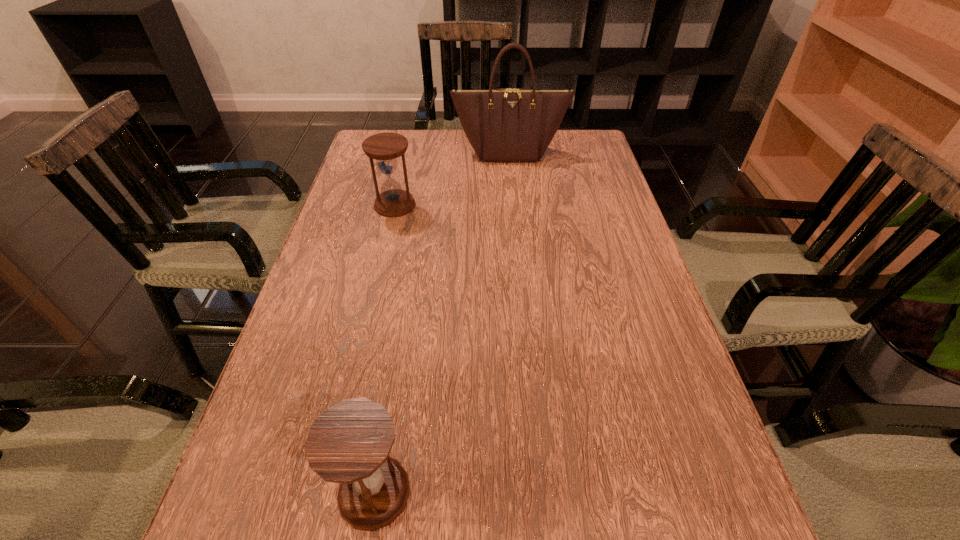
Identify the location of the tallest object. The image size is (960, 540). (508, 124).

The image size is (960, 540). What are the coordinates of `handbag` in the screenshot? It's located at (508, 124).

Find the location of a particular element. The height and width of the screenshot is (540, 960). the second farthest object is located at coordinates (385, 148).

The width and height of the screenshot is (960, 540). What are the coordinates of `the nearest object` in the screenshot? It's located at (349, 443).

Locate an element on the screen. vacant space situated 0.090m on the front-facing side of the handbag is located at coordinates (512, 181).

This screenshot has height=540, width=960. What are the coordinates of `vacant space located 0.390m on the right of the farther hourglass` in the screenshot? It's located at (564, 205).

Identify the location of vacant region located 0.240m on the back of the nearer hourglass. Image resolution: width=960 pixels, height=540 pixels. (400, 334).

Identify the location of object that is at the far edge. (508, 124).

At what (x,y) coordinates should I click in order to perform the action: click on object that is at the right edge. Please return your answer as a coordinate pair (x, y). The image size is (960, 540). Looking at the image, I should click on (508, 124).

Locate an element on the screen. object that is at the far right corner is located at coordinates (508, 124).